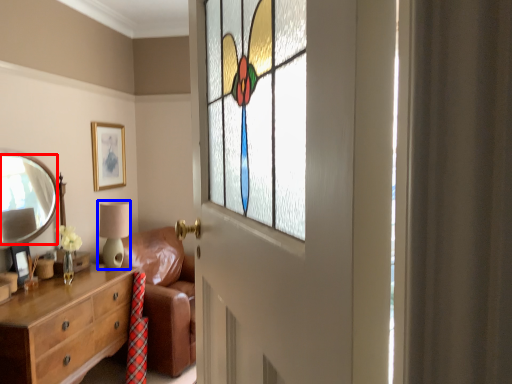
Question: Which point is closer to the camera, mirror (highlighted by a red box) or table lamp (highlighted by a blue box)?

Choices:
 (A) mirror
 (B) table lamp

Answer: (A)